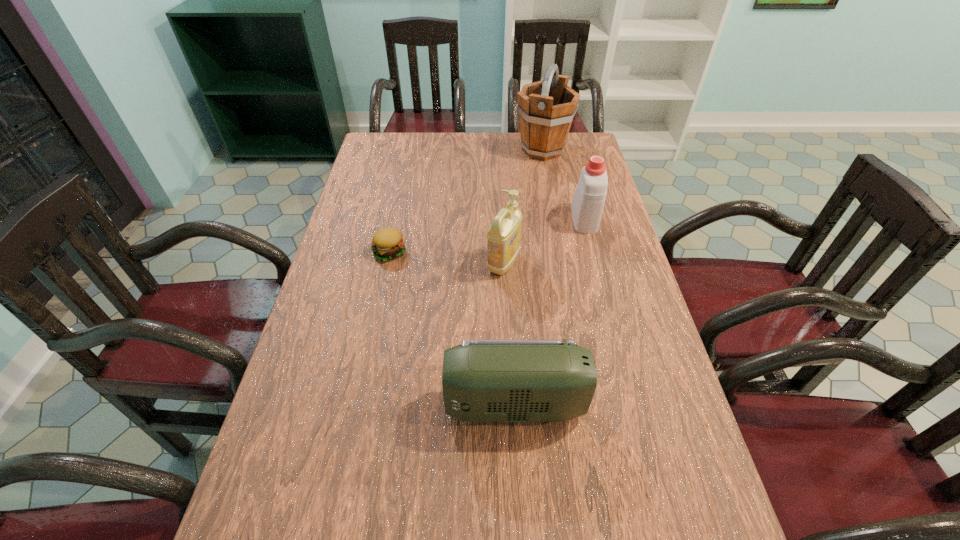
What are the coordinates of `vacant space situated on the handle side of the farther detergent` in the screenshot? It's located at (573, 179).

Identify the location of vacant area situated on the handle side of the farther detergent. (564, 144).

Locate an element on the screen. blank space located on the handle side of the farther detergent is located at coordinates (573, 178).

Where is `vacant space located 0.190m on the back of the left detergent`? This screenshot has height=540, width=960. vacant space located 0.190m on the back of the left detergent is located at coordinates (500, 209).

Where is `free point located 0.140m on the front-facing side of the nearest object`? free point located 0.140m on the front-facing side of the nearest object is located at coordinates (384, 404).

This screenshot has height=540, width=960. In order to click on blank space located 0.060m on the front-facing side of the nearest object in this screenshot , I will do `click(420, 404)`.

Identify the location of free location located 0.080m on the front-facing side of the nearest object. Image resolution: width=960 pixels, height=540 pixels. (411, 404).

In order to click on free space located 0.070m on the back of the leftmost object in this screenshot , I will do `click(395, 226)`.

I want to click on object that is at the far edge, so [x=546, y=108].

This screenshot has width=960, height=540. I want to click on object that is at the left edge, so click(x=387, y=243).